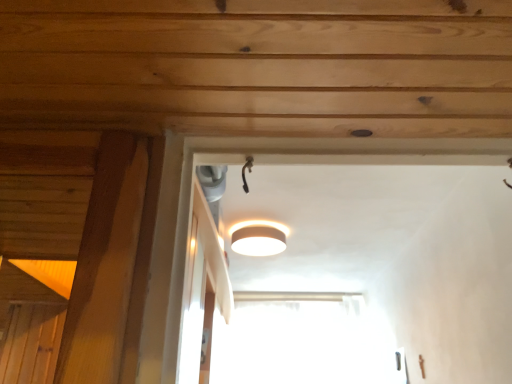
Question: From a real-world perspective, is transparent glass window at center below white matte lamp at upper center?

Choices:
 (A) yes
 (B) no

Answer: (A)

Question: Does transparent glass window at center touch white matte lamp at upper center?

Choices:
 (A) yes
 (B) no

Answer: (B)

Question: Would you say transparent glass window at center is a long distance from white matte lamp at upper center?

Choices:
 (A) no
 (B) yes

Answer: (B)

Question: From the image's perspective, would you say transparent glass window at center is positioned over white matte lamp at upper center?

Choices:
 (A) yes
 (B) no

Answer: (B)

Question: Is white matte lamp at upper center surrounded by transparent glass window at center?

Choices:
 (A) yes
 (B) no

Answer: (B)

Question: From the image's perspective, is transparent glass window at center under white matte lamp at upper center?

Choices:
 (A) no
 (B) yes

Answer: (B)

Question: Does white matte lamp at upper center have a greater width compared to transparent glass window at center?

Choices:
 (A) yes
 (B) no

Answer: (A)

Question: From the image's perspective, would you say white matte lamp at upper center is shown under transparent glass window at center?

Choices:
 (A) yes
 (B) no

Answer: (B)

Question: Is white matte lamp at upper center not within transparent glass window at center?

Choices:
 (A) no
 (B) yes

Answer: (B)

Question: Is white matte lamp at upper center to the right of transparent glass window at center from the viewer's perspective?

Choices:
 (A) yes
 (B) no

Answer: (B)

Question: Considering the relative sizes of white matte lamp at upper center and transparent glass window at center in the image provided, is white matte lamp at upper center taller than transparent glass window at center?

Choices:
 (A) yes
 (B) no

Answer: (B)

Question: From a real-world perspective, does white matte lamp at upper center stand above transparent glass window at center?

Choices:
 (A) yes
 (B) no

Answer: (A)

Question: In terms of height, does white matte lamp at upper center look taller or shorter compared to transparent glass window at center?

Choices:
 (A) tall
 (B) short

Answer: (B)